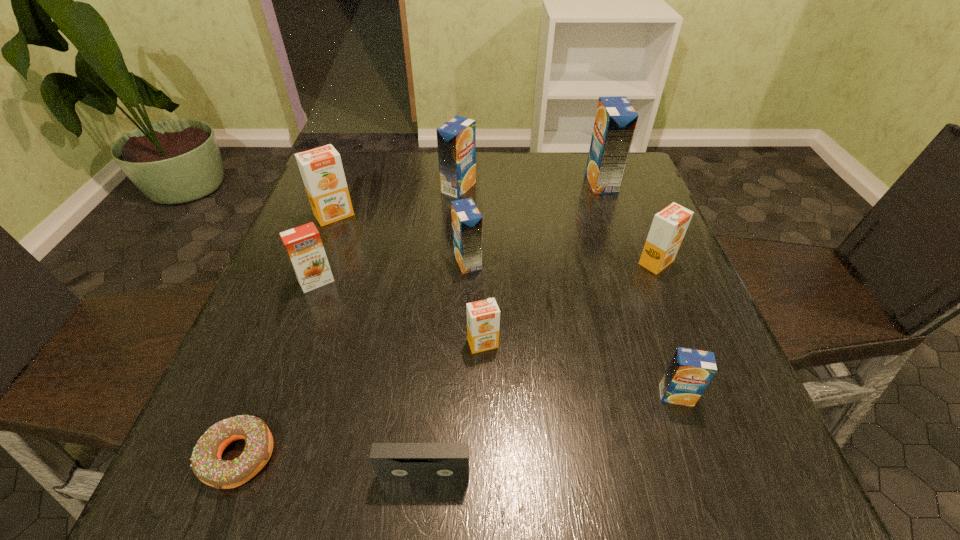
Point out which orange juice is positioned as the nearest to the rightmost orange orange juice. Please provide its 2D coordinates. Your answer should be formatted as a tuple, i.e. [(x, y)], where the tuple contains the x and y coordinates of a point satisfying the conditions above.

[(615, 122)]

At what (x,y) coordinates should I click in order to perform the action: click on blue orange_juice that is the third closest to the biggest blue orange_juice. Please return your answer as a coordinate pair (x, y). Looking at the image, I should click on (690, 371).

Where is `blue orange_juice object that ranks as the third closest to the third smallest blue orange_juice`? This screenshot has height=540, width=960. blue orange_juice object that ranks as the third closest to the third smallest blue orange_juice is located at coordinates (690, 371).

Point out which orange orange juice is positioned as the nearest to the rightmost orange orange juice. Please provide its 2D coordinates. Your answer should be formatted as a tuple, i.e. [(x, y)], where the tuple contains the x and y coordinates of a point satisfying the conditions above.

[(483, 317)]

You are a GUI agent. You are given a task and a screenshot of the screen. Output one action in this format:
    pyautogui.click(x=<x>, y=<y>)
    Task: Click on the closest orange orange juice to the second biggest blue orange_juice
    
    Given the screenshot: What is the action you would take?
    pyautogui.click(x=321, y=168)

This screenshot has width=960, height=540. I want to click on free location that satisfies the following two spatial constraints: 1. on the front side of the rightmost orange orange juice; 2. on the left side of the eighth nearest object, so click(316, 262).

At what (x,y) coordinates should I click in order to perform the action: click on free space that satisfies the following two spatial constraints: 1. on the back side of the biggest orange orange juice; 2. on the left side of the third smallest blue orange_juice. Please return your answer as a coordinate pair (x, y). The width and height of the screenshot is (960, 540). Looking at the image, I should click on (345, 187).

At what (x,y) coordinates should I click in order to perform the action: click on free space in the image that satisfies the following two spatial constraints: 1. on the front side of the rightmost orange orange juice; 2. on the right side of the farthest orange orange juice. Please return your answer as a coordinate pair (x, y). The width and height of the screenshot is (960, 540). Looking at the image, I should click on (316, 262).